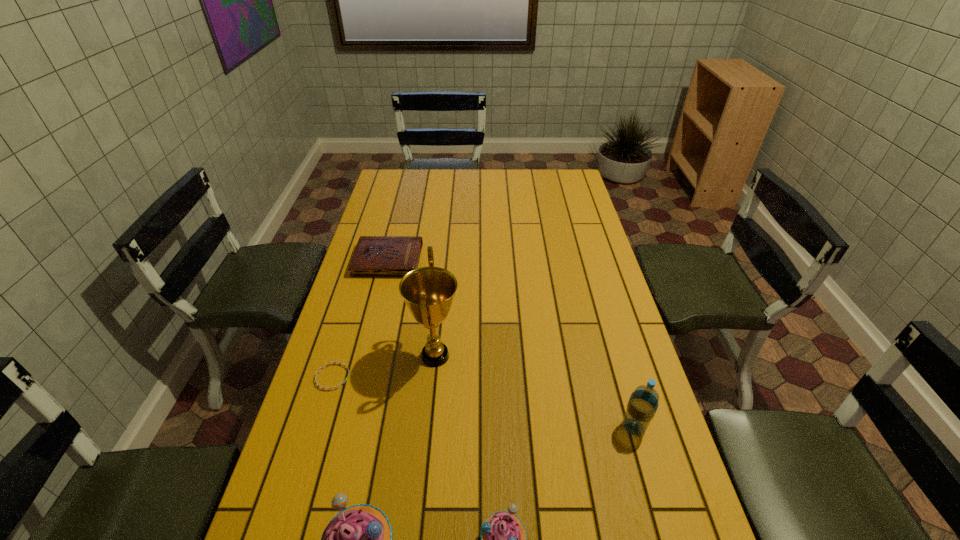
At what (x,y) coordinates should I click in order to perform the action: click on hardback book that is at the left edge. Please return your answer as a coordinate pair (x, y). This screenshot has height=540, width=960. Looking at the image, I should click on (375, 256).

The height and width of the screenshot is (540, 960). Identify the location of bracelet that is at the left edge. (341, 363).

Locate an element on the screen. object present at the right edge is located at coordinates (643, 403).

You are a GUI agent. You are given a task and a screenshot of the screen. Output one action in this format:
    pyautogui.click(x=<x>, y=<y>)
    Task: Click on the vacant space at the far edge of the desktop
    This screenshot has width=960, height=540.
    Given the screenshot: What is the action you would take?
    pyautogui.click(x=440, y=187)

In the image, there is a desktop. At what (x,y) coordinates should I click in order to perform the action: click on vacant space at the left edge. Please return your answer as a coordinate pair (x, y). This screenshot has width=960, height=540. Looking at the image, I should click on (409, 200).

The height and width of the screenshot is (540, 960). In the image, there is a desktop. Find the location of `vacant space at the right edge`. vacant space at the right edge is located at coordinates (574, 214).

At what (x,y) coordinates should I click in order to perform the action: click on free space at the far right corner of the desktop. Please return your answer as a coordinate pair (x, y). This screenshot has width=960, height=540. Looking at the image, I should click on point(549,183).

You are a GUI agent. You are given a task and a screenshot of the screen. Output one action in this format:
    pyautogui.click(x=<x>, y=<y>)
    Task: Click on the vacant region between the second shortest object and the shortest object
    The width and height of the screenshot is (960, 540).
    Given the screenshot: What is the action you would take?
    pyautogui.click(x=360, y=319)

This screenshot has height=540, width=960. I want to click on vacant space that's between the second shortest object and the bracelet, so click(360, 319).

Locate an element on the screen. vacant space in between the award and the bracelet is located at coordinates (384, 367).